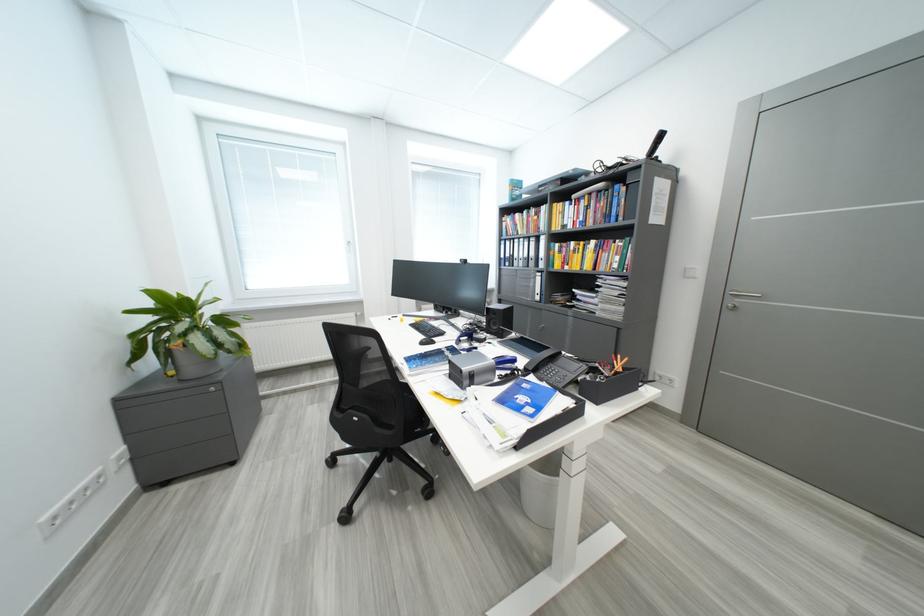
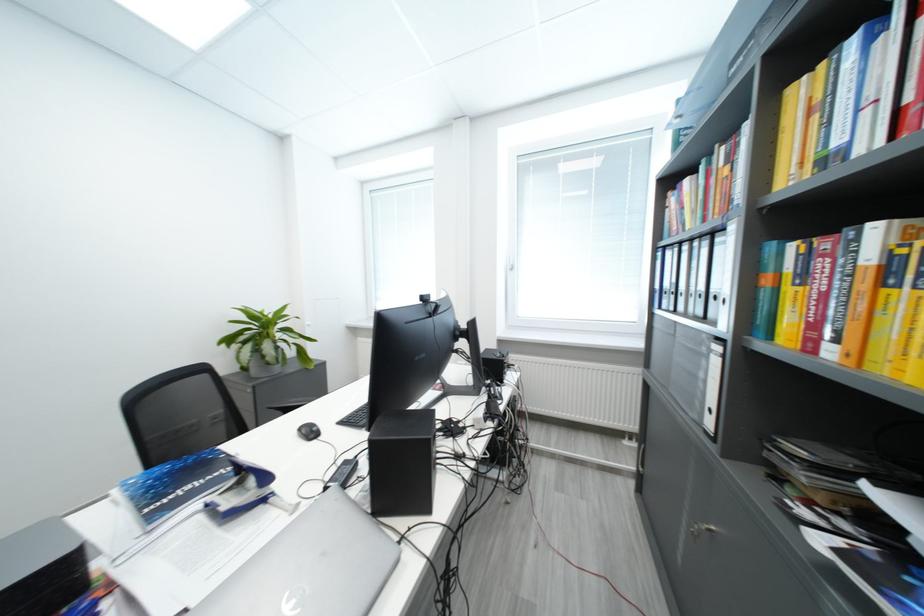
Where in the second image is the point corresponding to the point at 576,206 from the first image?

(861, 44)